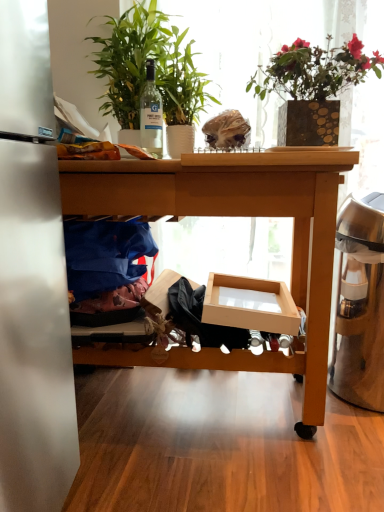
Question: Is green leafy plant at upper left, marked as the first houseplant in a left-to-right arrangement, beside clear glass bottle at center?

Choices:
 (A) yes
 (B) no

Answer: (B)

Question: From a real-world perspective, is green leafy plant at upper left, marked as the first houseplant in a left-to-right arrangement, located higher than clear glass bottle at center?

Choices:
 (A) yes
 (B) no

Answer: (A)

Question: From the image's perspective, is green leafy plant at upper left, marked as the first houseplant in a left-to-right arrangement, located above clear glass bottle at center?

Choices:
 (A) no
 (B) yes

Answer: (B)

Question: Considering the relative positions of green leafy plant at upper left, which is counted as the 2th houseplant, starting from the right, and clear glass bottle at center in the image provided, is green leafy plant at upper left, which is counted as the 2th houseplant, starting from the right, to the right of clear glass bottle at center from the viewer's perspective?

Choices:
 (A) no
 (B) yes

Answer: (A)

Question: Can you confirm if green leafy plant at upper left, marked as the first houseplant in a left-to-right arrangement, is bigger than clear glass bottle at center?

Choices:
 (A) no
 (B) yes

Answer: (B)

Question: Is wooden desk at center bigger or smaller than cardboard box at center?

Choices:
 (A) big
 (B) small

Answer: (A)

Question: From the image's perspective, is wooden desk at center above or below cardboard box at center?

Choices:
 (A) above
 (B) below

Answer: (A)

Question: In terms of width, does wooden desk at center look wider or thinner when compared to cardboard box at center?

Choices:
 (A) wide
 (B) thin

Answer: (A)

Question: In the image, is wooden desk at center on the left side or the right side of cardboard box at center?

Choices:
 (A) right
 (B) left

Answer: (B)

Question: From the image's perspective, is cardboard box at center positioned above or below wooden desk at center?

Choices:
 (A) above
 (B) below

Answer: (B)

Question: Looking at the image, does cardboard box at center seem bigger or smaller compared to wooden desk at center?

Choices:
 (A) small
 (B) big

Answer: (A)

Question: In the image, is cardboard box at center positioned in front of or behind wooden desk at center?

Choices:
 (A) behind
 (B) front

Answer: (A)

Question: Does point (289, 297) appear closer or farther from the camera than point (309, 265)?

Choices:
 (A) closer
 (B) farther

Answer: (B)

Question: Considering the relative positions of gold textured vase at upper right, placed as the first houseplant when sorted from right to left, and wooden desk at center in the image provided, is gold textured vase at upper right, placed as the first houseplant when sorted from right to left, to the left or to the right of wooden desk at center?

Choices:
 (A) left
 (B) right

Answer: (B)

Question: Based on their sizes in the image, would you say gold textured vase at upper right, placed as the first houseplant when sorted from right to left, is bigger or smaller than wooden desk at center?

Choices:
 (A) small
 (B) big

Answer: (A)